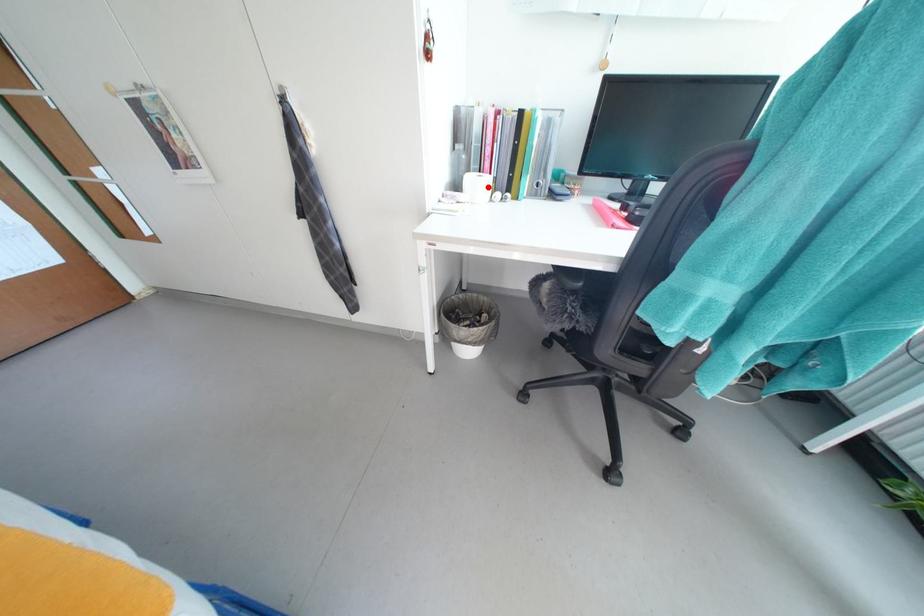
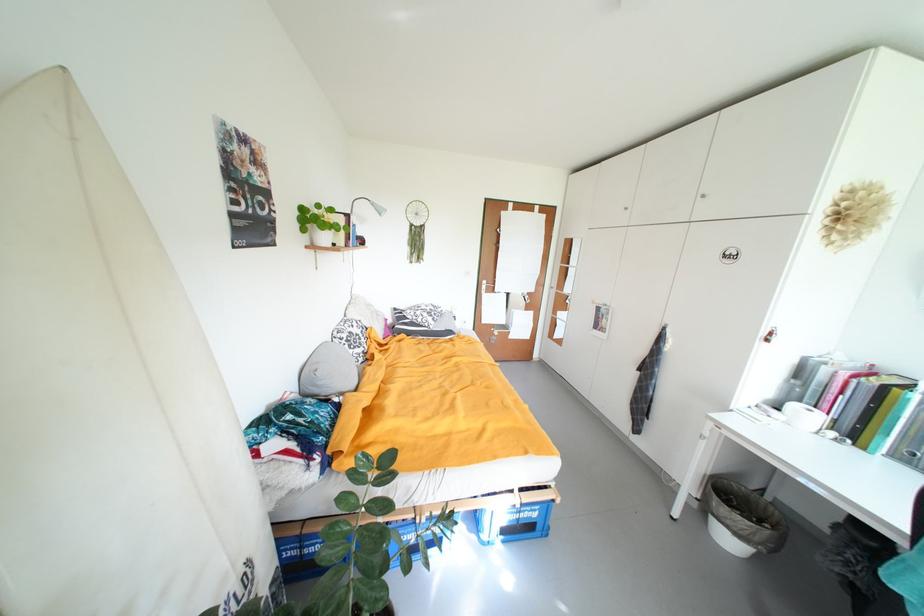
Question: I am providing you with two images of the same scene from different viewpoints. A red point is marked on the first image. Can you still see the location of the red point in image 2?

Choices:
 (A) Yes
 (B) No

Answer: (A)